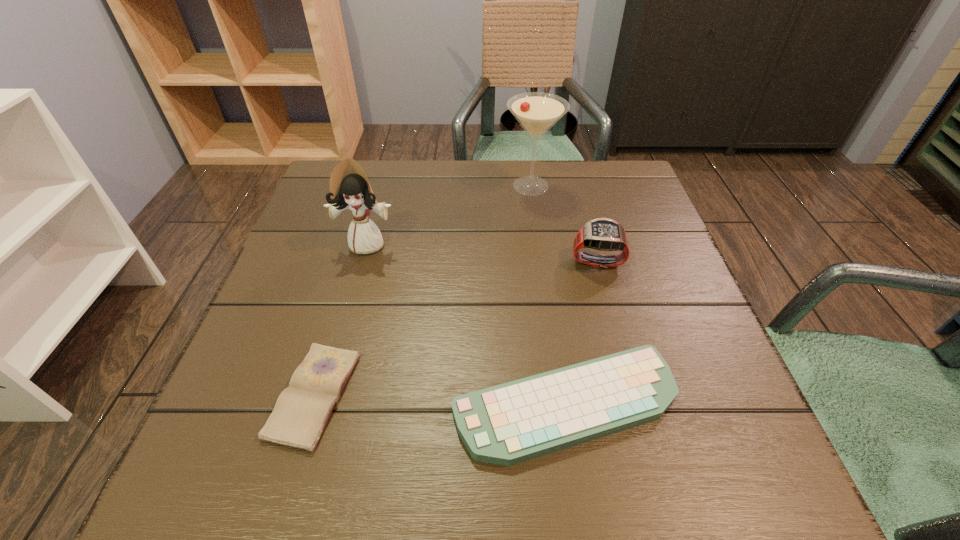
I want to click on the farthest object, so click(x=537, y=112).

Find the location of a particular element. The width and height of the screenshot is (960, 540). doll is located at coordinates (349, 187).

Identify the location of watch. The image size is (960, 540). (604, 234).

Where is `the fourth tallest object`? Image resolution: width=960 pixels, height=540 pixels. the fourth tallest object is located at coordinates (507, 424).

Find the location of `diary`. diary is located at coordinates (302, 410).

Locate an element on the screen. Image resolution: width=960 pixels, height=540 pixels. blank space located on the front of the farthest object is located at coordinates (546, 297).

Where is `vacant area situated 0.240m at the front face of the doll`? Image resolution: width=960 pixels, height=540 pixels. vacant area situated 0.240m at the front face of the doll is located at coordinates (339, 348).

Identify the location of vacant space located 0.170m on the left of the third shortest object. (492, 261).

The height and width of the screenshot is (540, 960). In order to click on free spot located on the back of the fourth tallest object in this screenshot , I will do `click(542, 254)`.

Identify the location of vacant area situated on the right of the shortest object. (431, 395).